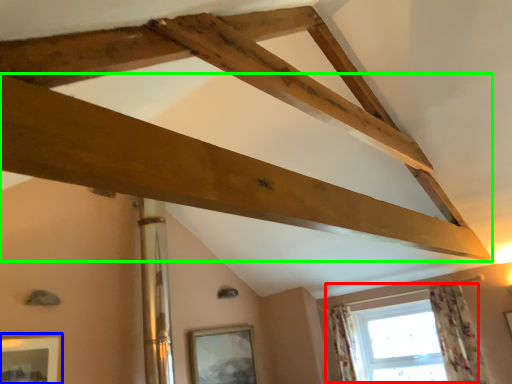
Question: Estimate the real-world distances between objects in this image. Which object is farther from window (highlighted by a red box), picture frame (highlighted by a blue box) or plank (highlighted by a green box)?

Choices:
 (A) picture frame
 (B) plank

Answer: (A)